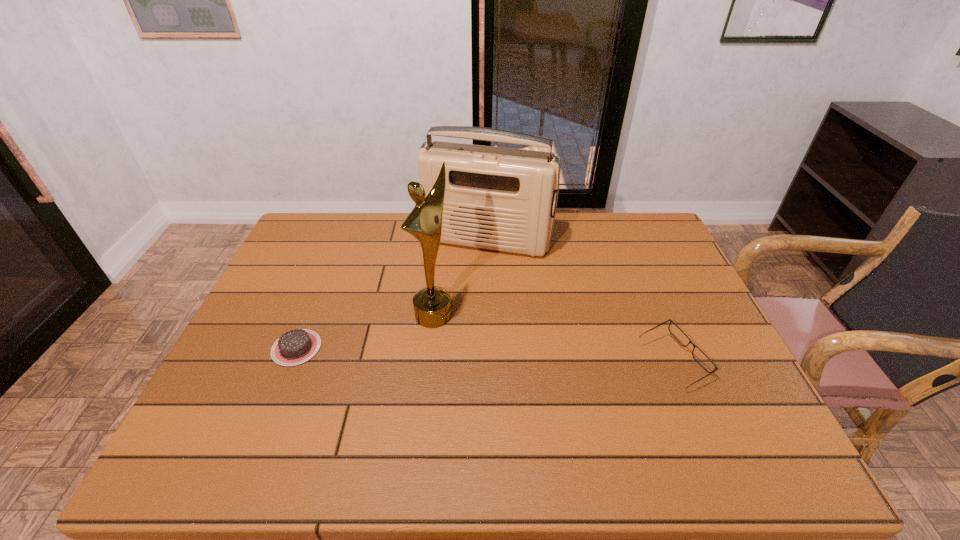
Locate an element on the screen. vacant region at the near edge is located at coordinates (300, 416).

Find the location of `free space at the left edge of the desktop`. free space at the left edge of the desktop is located at coordinates (239, 359).

Identify the location of blank space at the right edge. (695, 366).

The width and height of the screenshot is (960, 540). Find the location of `vacant space at the far left corner of the desktop`. vacant space at the far left corner of the desktop is located at coordinates (324, 221).

What are the coordinates of `vacant region at the near left corner` in the screenshot? It's located at (245, 421).

Identify the location of free space between the award and the leftmost object. (365, 331).

At what (x,y) coordinates should I click in order to perform the action: click on vacant point located between the rightmost object and the shortest object. Please return your answer as a coordinate pair (x, y). The width and height of the screenshot is (960, 540). Looking at the image, I should click on (485, 355).

This screenshot has height=540, width=960. What are the coordinates of `free spot between the spectacles and the radio receiver` in the screenshot? It's located at (581, 301).

Find the location of `vacant space in between the award and the third tallest object`. vacant space in between the award and the third tallest object is located at coordinates (553, 338).

This screenshot has width=960, height=540. Find the location of `free space between the award and the spectacles`. free space between the award and the spectacles is located at coordinates click(x=553, y=338).